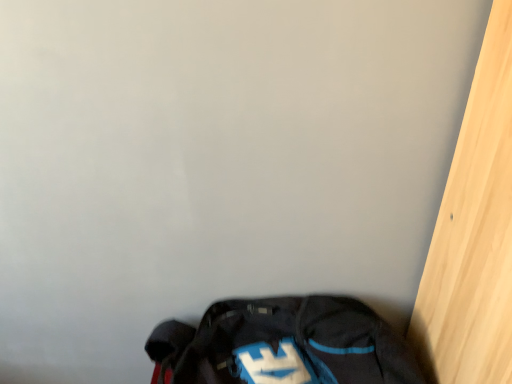
You are a GUI agent. You are given a task and a screenshot of the screen. Output one action in this format:
    pyautogui.click(x=<x>, y=<y>)
    Task: Click on the dark blue fabric backpack at lower right
    The image size is (512, 384).
    Given the screenshot: What is the action you would take?
    pyautogui.click(x=283, y=345)

The height and width of the screenshot is (384, 512). Describe the element at coordinates (283, 345) in the screenshot. I see `dark blue fabric backpack at lower right` at that location.

Where is `dark blue fabric backpack at lower right`? The width and height of the screenshot is (512, 384). dark blue fabric backpack at lower right is located at coordinates (283, 345).